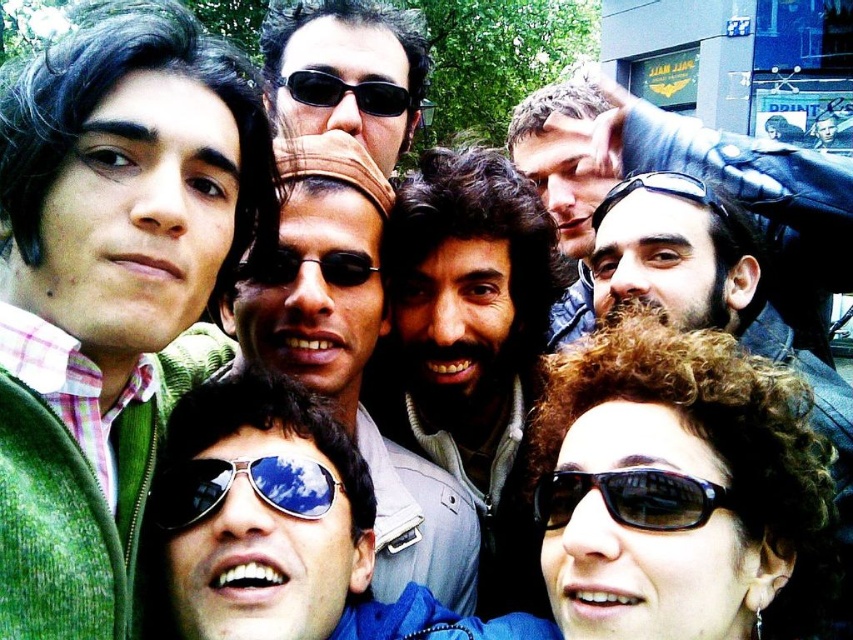
Does reflective aviator sunglasses at center have a lesser height compared to black reflective sunglasses at upper center?

Yes.

Image resolution: width=853 pixels, height=640 pixels. What do you see at coordinates (248, 483) in the screenshot?
I see `reflective aviator sunglasses at center` at bounding box center [248, 483].

You are a GUI agent. You are given a task and a screenshot of the screen. Output one action in this format:
    pyautogui.click(x=<x>, y=<y>)
    Task: Click on the reflective aviator sunglasses at center
    The image size is (853, 640).
    Given the screenshot: What is the action you would take?
    pyautogui.click(x=248, y=483)

Who is more distant from viewer, (634, 524) or (674, 189)?

The point (674, 189) is behind.

Is black reflective sunglasses at lower center to the right of black reflective sunglasses at upper center from the viewer's perspective?

No, black reflective sunglasses at lower center is not to the right of black reflective sunglasses at upper center.

Does point (554, 477) lie behind point (647, 186)?

That is False.

The height and width of the screenshot is (640, 853). I want to click on black reflective sunglasses at lower center, so click(x=631, y=497).

Is matte black sunglasses at center positioned at the back of smooth leather jacket at upper center?

Yes, it is.

Looking at this image, which is more to the left, matte black sunglasses at center or smooth leather jacket at upper center?

matte black sunglasses at center

The width and height of the screenshot is (853, 640). I want to click on matte black sunglasses at center, so click(x=346, y=72).